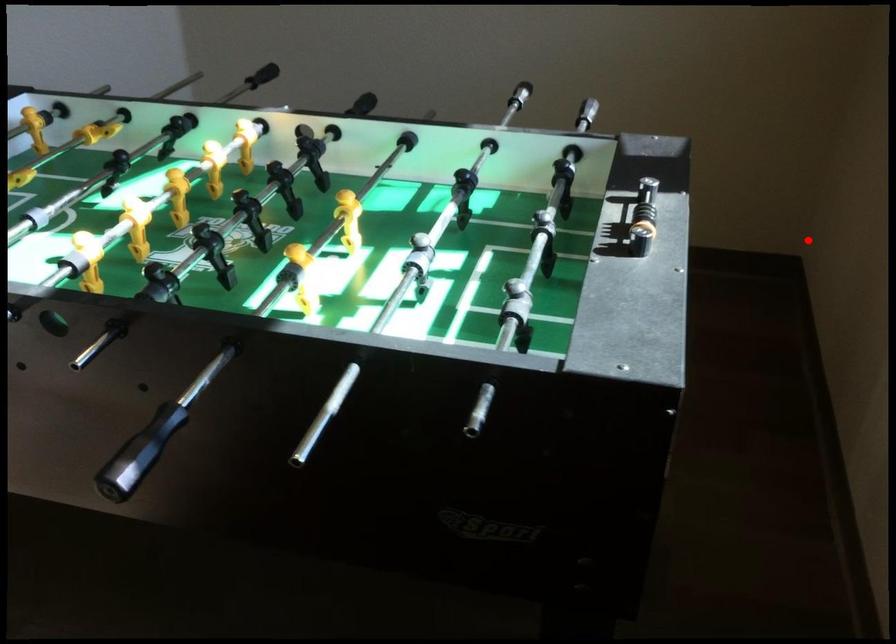
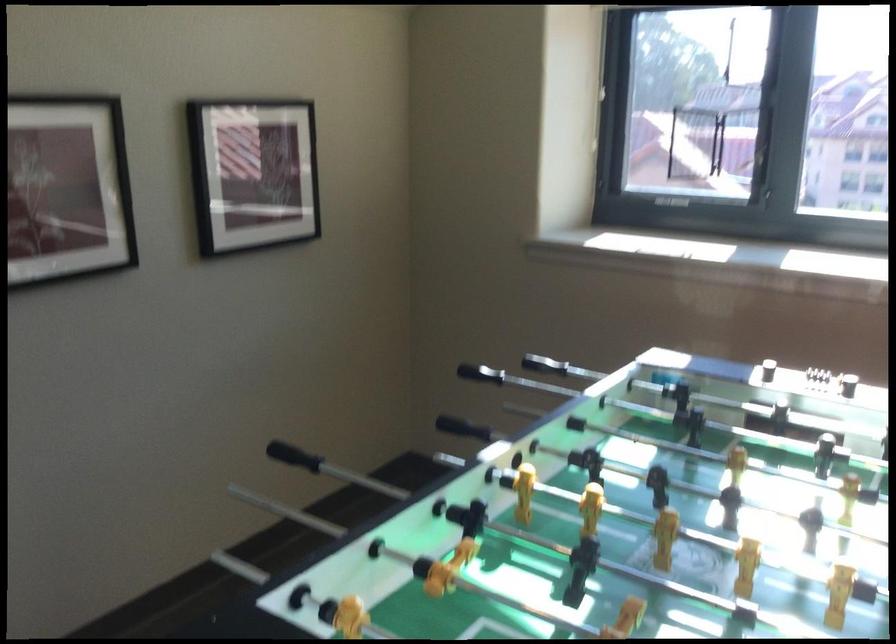
Question: I am providing you with two images of the same scene from different viewpoints. Given a red point in image1, look at the same physical point in image2. Is it:

Choices:
 (A) Closer to the viewpoint
 (B) Farther from the viewpoint

Answer: (B)